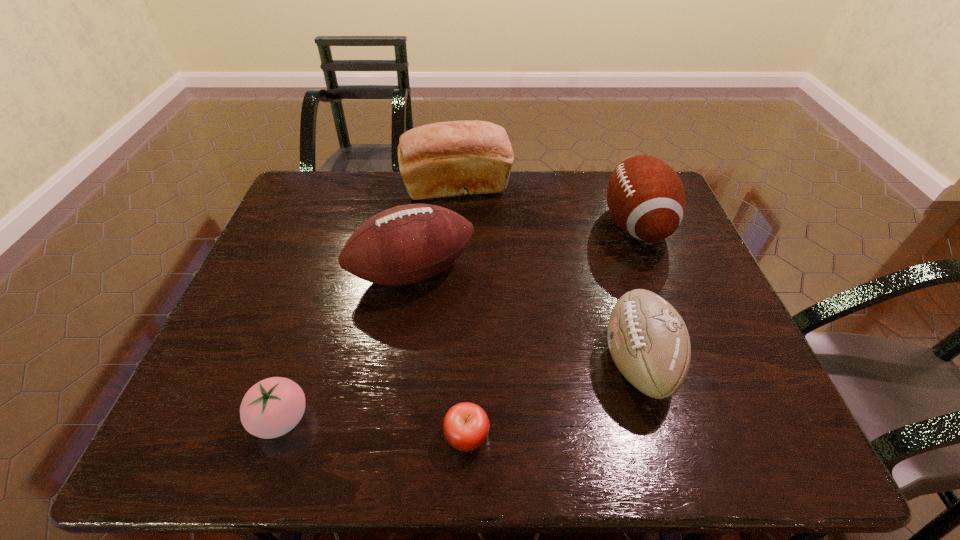
At what (x,y) coordinates should I click in order to perform the action: click on free space that is in between the shortest object and the leftmost football (American). Please return your answer as a coordinate pair (x, y). The width and height of the screenshot is (960, 540). Looking at the image, I should click on (440, 354).

You are a GUI agent. You are given a task and a screenshot of the screen. Output one action in this format:
    pyautogui.click(x=<x>, y=<y>)
    Task: Click on the free space between the fifth tallest object and the shortest object
    
    Given the screenshot: What is the action you would take?
    pyautogui.click(x=374, y=427)

Where is `free space between the second shortest object and the bread`? The width and height of the screenshot is (960, 540). free space between the second shortest object and the bread is located at coordinates (370, 304).

I want to click on the fourth closest object to the bread, so click(x=272, y=407).

I want to click on the fifth closest object to the bread, so click(466, 426).

I want to click on football (American) object that ranks as the third closest to the shortest object, so click(645, 196).

Choose which football (American) is the second nearest neighbor to the shortest football (American). Please provide its 2D coordinates. Your answer should be formatted as a tuple, i.e. [(x, y)], where the tuple contains the x and y coordinates of a point satisfying the conditions above.

[(406, 244)]

The height and width of the screenshot is (540, 960). I want to click on free space that satisfies the following two spatial constraints: 1. on the laces of the fourth tallest object; 2. on the front side of the apple, so click(x=660, y=436).